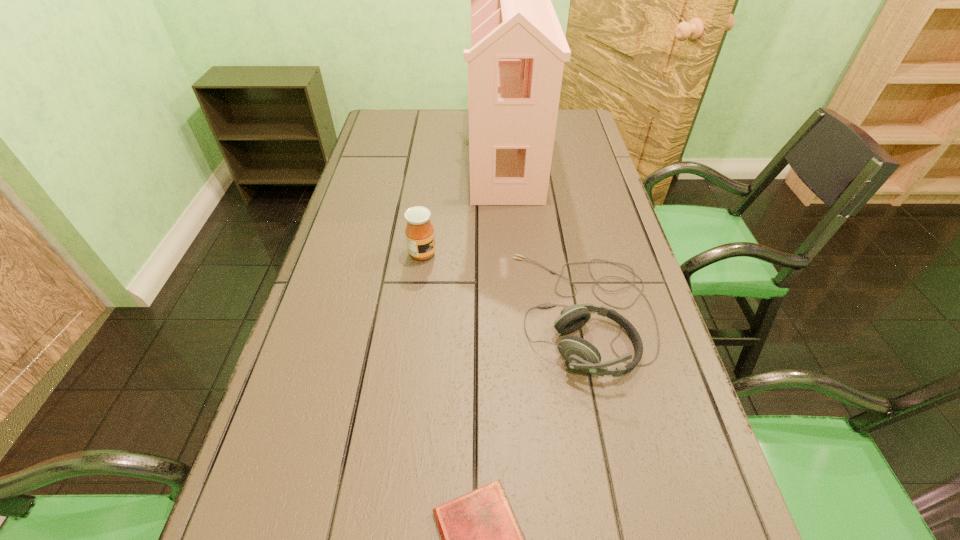
Where is `vacant region between the second tallest object and the dollhouse`? vacant region between the second tallest object and the dollhouse is located at coordinates (464, 206).

In order to click on vacant space that is in between the dollhouse and the second shortest object in this screenshot , I will do `click(545, 235)`.

This screenshot has width=960, height=540. In order to click on vacant area that lies between the third shortest object and the tallest object in this screenshot , I will do `click(464, 206)`.

I want to click on free spot between the farthest object and the headset, so click(545, 235).

Locate an element on the screen. free spot between the farthest object and the leftmost object is located at coordinates (464, 206).

Locate an element on the screen. object that ranks as the second closest to the third shortest object is located at coordinates pyautogui.click(x=580, y=354).

Locate which object ranks second in proximity to the diary. Please provide its 2D coordinates. Your answer should be formatted as a tuple, i.e. [(x, y)], where the tuple contains the x and y coordinates of a point satisfying the conditions above.

[(419, 231)]